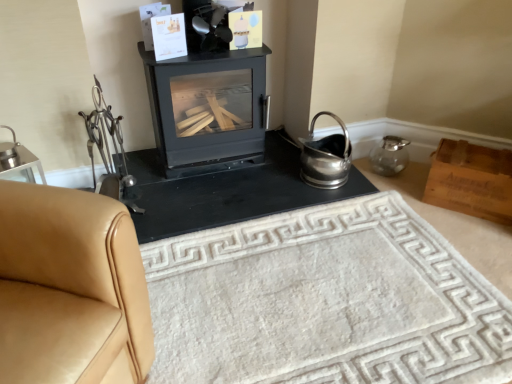
Question: From a real-world perspective, is tan leather couch at left below black matte fireplace at center?

Choices:
 (A) no
 (B) yes

Answer: (A)

Question: Is tan leather couch at left taller than black matte fireplace at center?

Choices:
 (A) yes
 (B) no

Answer: (A)

Question: Does tan leather couch at left have a greater width compared to black matte fireplace at center?

Choices:
 (A) yes
 (B) no

Answer: (B)

Question: From a real-world perspective, is tan leather couch at left positioned over black matte fireplace at center based on gravity?

Choices:
 (A) no
 (B) yes

Answer: (B)

Question: Is tan leather couch at left smaller than black matte fireplace at center?

Choices:
 (A) yes
 (B) no

Answer: (B)

Question: Is white textured rug at center wider or thinner than tan leather couch at left?

Choices:
 (A) thin
 (B) wide

Answer: (B)

Question: Is point (388, 259) closer or farther from the camera than point (26, 213)?

Choices:
 (A) closer
 (B) farther

Answer: (B)

Question: Would you say white textured rug at center is inside or outside tan leather couch at left?

Choices:
 (A) inside
 (B) outside

Answer: (B)

Question: From their relative heights in the image, would you say white textured rug at center is taller or shorter than tan leather couch at left?

Choices:
 (A) tall
 (B) short

Answer: (B)

Question: Considering the positions of point (144, 238) and point (193, 319), is point (144, 238) closer or farther from the camera than point (193, 319)?

Choices:
 (A) farther
 (B) closer

Answer: (A)

Question: In terms of height, does black matte fireplace at center look taller or shorter compared to white textured rug at center?

Choices:
 (A) tall
 (B) short

Answer: (B)

Question: Based on their positions, is black matte fireplace at center located to the left or right of white textured rug at center?

Choices:
 (A) right
 (B) left

Answer: (B)

Question: From the image's perspective, is black matte fireplace at center positioned above or below white textured rug at center?

Choices:
 (A) above
 (B) below

Answer: (A)

Question: Is black matte wood burning stove at center to the left or to the right of wooden box at right in the image?

Choices:
 (A) right
 (B) left

Answer: (B)

Question: Does point (170, 99) appear closer or farther from the camera than point (464, 155)?

Choices:
 (A) farther
 (B) closer

Answer: (B)